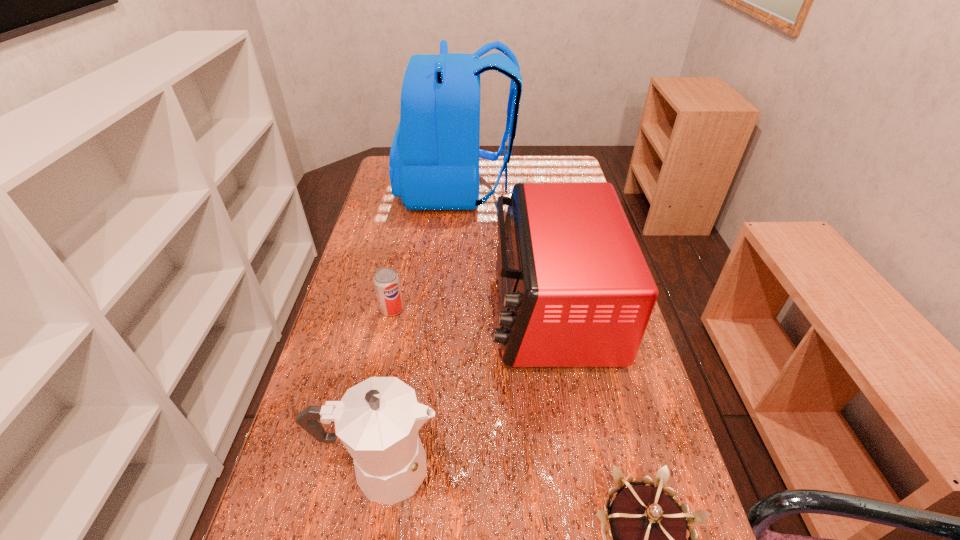
Locate an element on the screen. The width and height of the screenshot is (960, 540). backpack is located at coordinates (434, 159).

Where is `the farthest object`? the farthest object is located at coordinates (434, 159).

This screenshot has height=540, width=960. I want to click on toaster oven, so click(575, 290).

Locate an element on the screen. The width and height of the screenshot is (960, 540). coffeepot is located at coordinates (377, 420).

Image resolution: width=960 pixels, height=540 pixels. Identify the location of soda. (386, 281).

Image resolution: width=960 pixels, height=540 pixels. I want to click on vacant position located 0.050m on the back of the tallest object, so click(x=528, y=190).

In order to click on free space located on the front-facing side of the toaster oven in this screenshot , I will do `click(390, 308)`.

Find the location of a particular element. Image resolution: width=960 pixels, height=540 pixels. free space located 0.230m on the front-facing side of the toaster oven is located at coordinates click(x=405, y=308).

I want to click on free space located on the front-facing side of the toaster oven, so click(431, 308).

This screenshot has height=540, width=960. I want to click on vacant space located at the spout of the coffeepot, so click(477, 469).